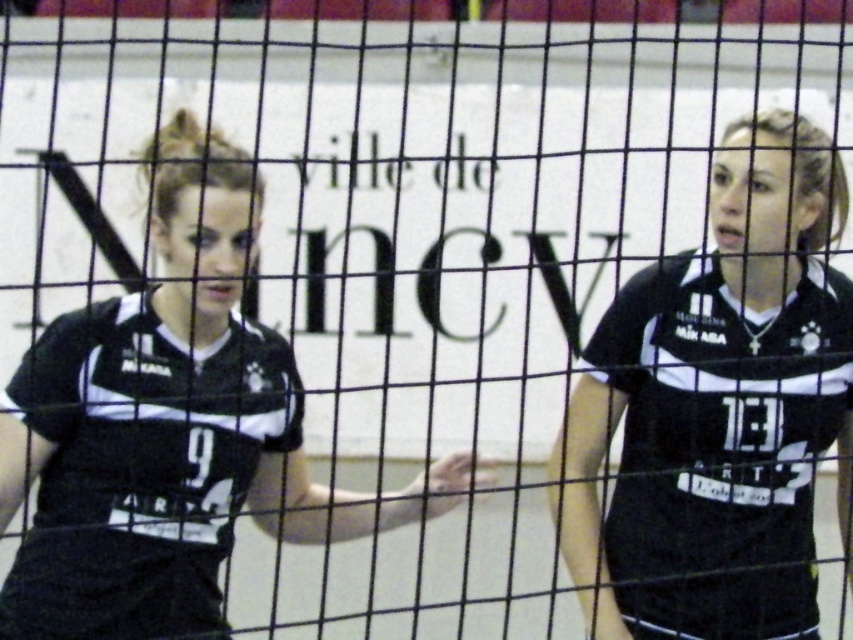
Question: Is black matte jersey at center closer to camera compared to matte black jersey at center?

Choices:
 (A) no
 (B) yes

Answer: (A)

Question: Is black matte jersey at center positioned at the back of matte black jersey at center?

Choices:
 (A) no
 (B) yes

Answer: (B)

Question: Which of the following is the closest to the observer?

Choices:
 (A) black matte jersey at center
 (B) matte black jersey at center

Answer: (B)

Question: Can you confirm if black matte jersey at center is positioned to the right of matte black jersey at center?

Choices:
 (A) no
 (B) yes

Answer: (B)

Question: Which object is farther from the camera taking this photo?

Choices:
 (A) matte black jersey at center
 (B) black matte jersey at center

Answer: (B)